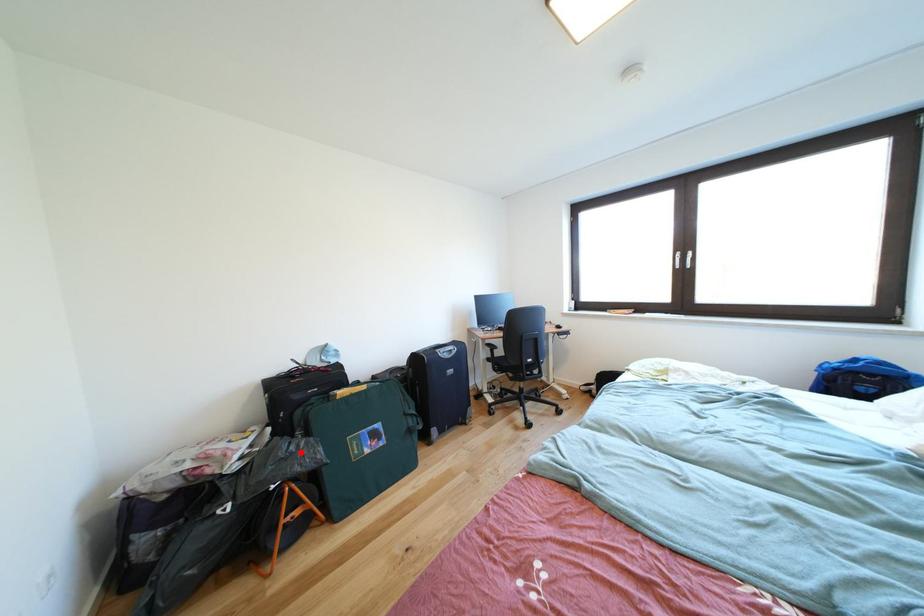
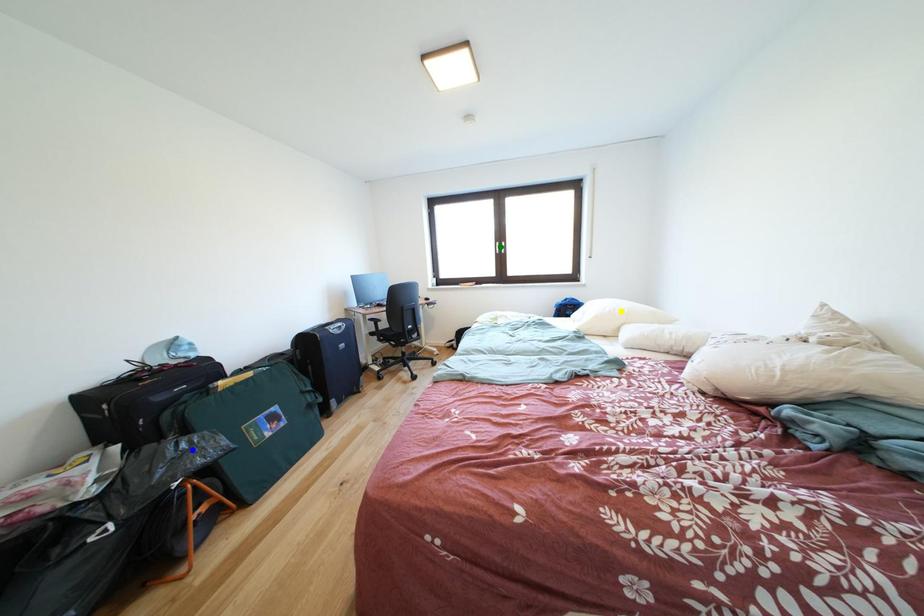
Question: I am providing you with two images of the same scene from different viewpoints. A red point is marked on the first image. You are given multiple points on the second image. Which mark in image 2 goes with the point in image 1?

Choices:
 (A) yellow point
 (B) green point
 (C) blue point

Answer: (C)